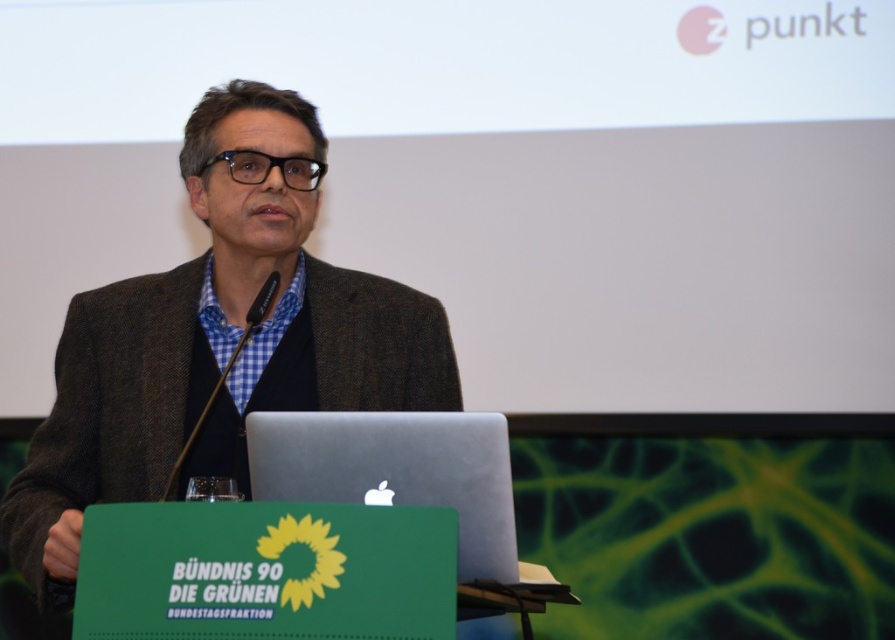
Does point (67, 564) come farther from viewer compared to point (492, 448)?

Yes, point (67, 564) is farther from viewer.

Who is positioned more to the left, brown woolen jacket at center or silver metallic laptop at center?

From the viewer's perspective, brown woolen jacket at center appears more on the left side.

Is point (159, 346) less distant than point (367, 417)?

No.

Locate an element on the screen. Image resolution: width=895 pixels, height=640 pixels. brown woolen jacket at center is located at coordinates (217, 339).